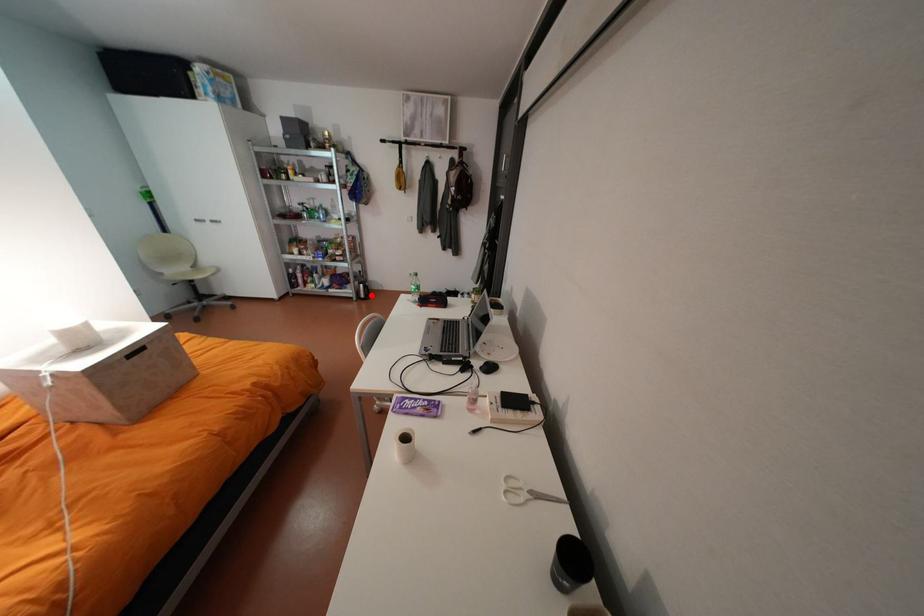
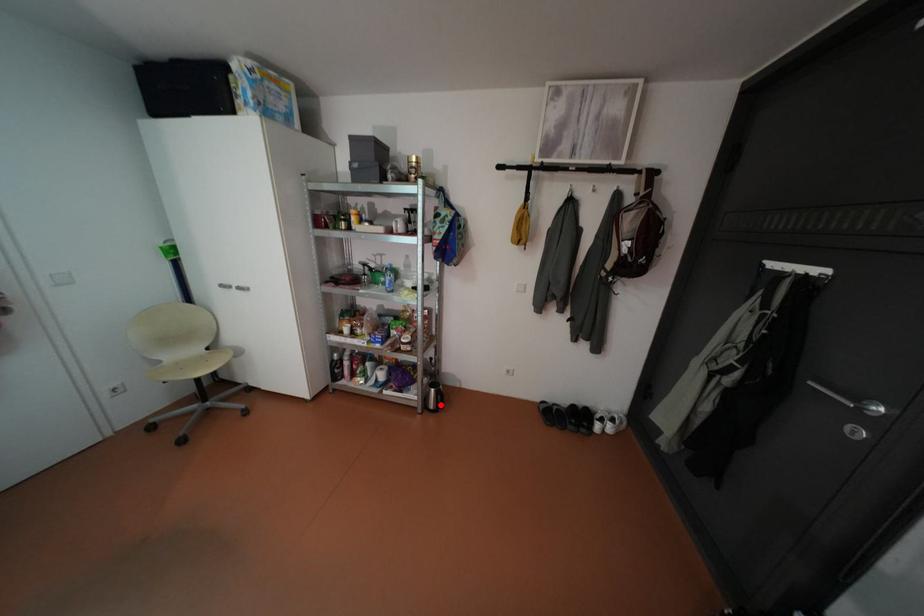
I am providing you with two images of the same scene from different viewpoints. A red point is marked on the first image and another point is marked on the second image. Do the highlighted points in image1 and image2 indicate the same real-world spot?

Yes